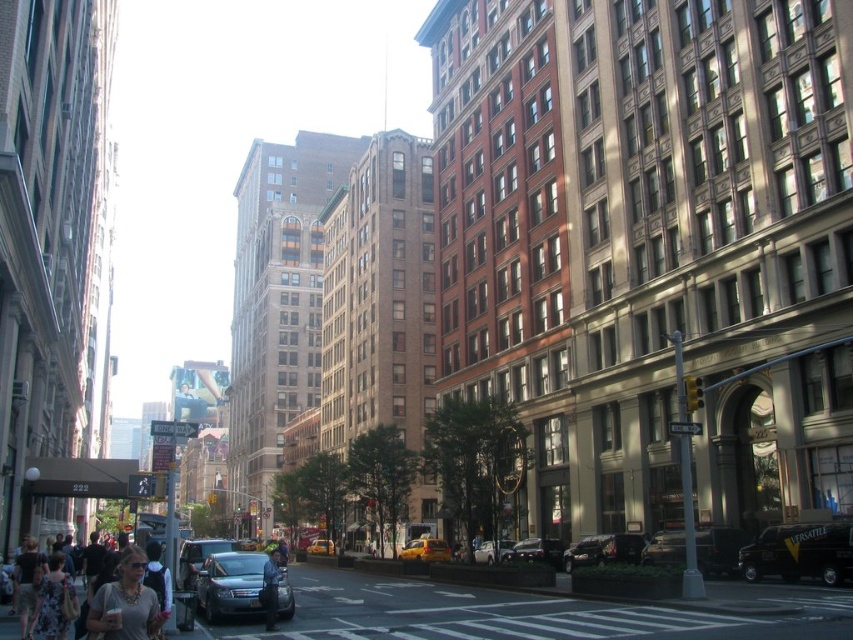
You are a pedestrian standing on the sidewalk and see the black matte suv at center and the shiny black sedan at center. Which vehicle is closer to the right side of the street?

The black matte suv at center is positioned on the right side of the shiny black sedan at center, so it is closer to the right side of the street.